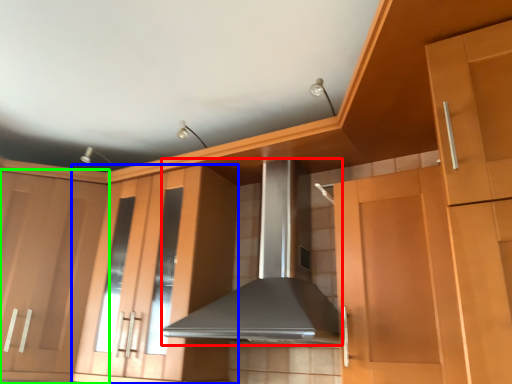
Question: Based on their relative distances, which object is farther from home appliance (highlighted by a red box)? Choose from cabinetry (highlighted by a blue box) and cabinetry (highlighted by a green box).

Choices:
 (A) cabinetry
 (B) cabinetry

Answer: (B)